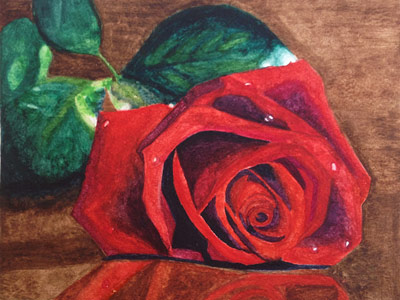
Locate an element on the screen. This screenshot has height=300, width=400. painting is located at coordinates (18, 263).